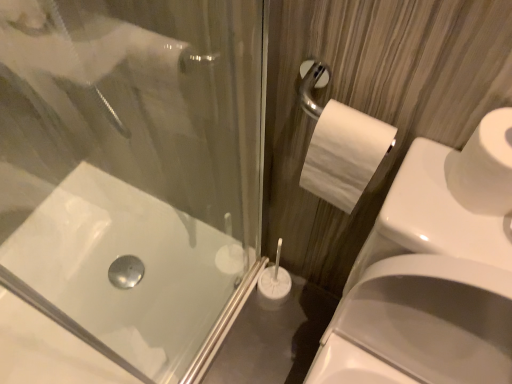
Question: Is white matte toilet paper at right, the 2th toilet paper positioned from the left, situated inside white matte toilet paper at right, which is counted as the 2th toilet paper, starting from the right, or outside?

Choices:
 (A) inside
 (B) outside

Answer: (B)

Question: Considering the positions of white matte toilet paper at right, the 2th toilet paper positioned from the left, and white matte toilet paper at right, which is counted as the 2th toilet paper, starting from the right, in the image, is white matte toilet paper at right, the 2th toilet paper positioned from the left, wider or thinner than white matte toilet paper at right, which is counted as the 2th toilet paper, starting from the right,?

Choices:
 (A) thin
 (B) wide

Answer: (B)

Question: Which of these objects is positioned farthest from the white matte toilet paper at right, the 2th toilet paper positioned from the left?

Choices:
 (A) white glossy bath at lower left
 (B) white matte toilet paper at right, which is counted as the 1th toilet paper, starting from the left
 (C) white glossy sink at lower right

Answer: (A)

Question: Which object is positioned farthest from the white matte toilet paper at right, which is counted as the 2th toilet paper, starting from the right?

Choices:
 (A) white glossy bath at lower left
 (B) white matte toilet paper at right, the 2th toilet paper positioned from the left
 (C) white glossy sink at lower right

Answer: (A)